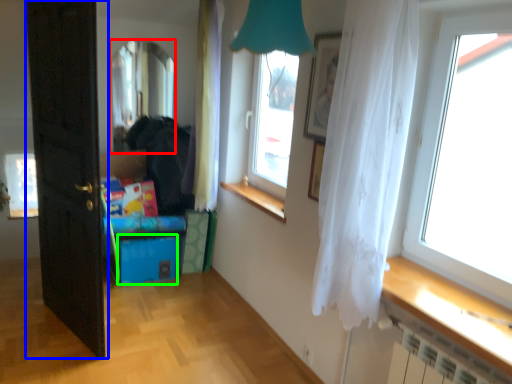
Question: Based on their relative distances, which object is farther from window (highlighted by a red box)? Choose from door (highlighted by a blue box) and storage box (highlighted by a green box).

Choices:
 (A) door
 (B) storage box

Answer: (A)